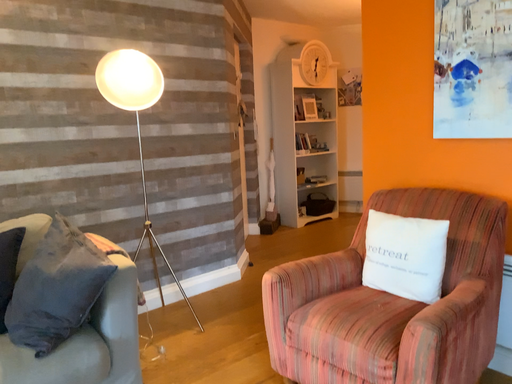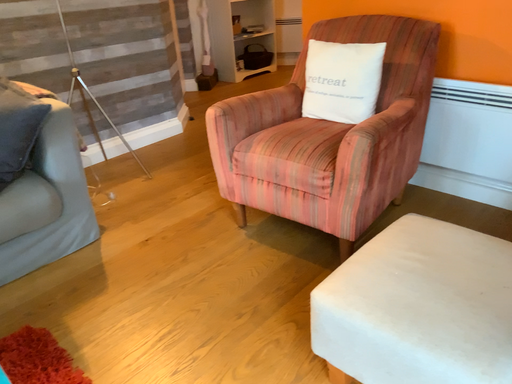
Question: Which way did the camera rotate in the video?

Choices:
 (A) rotated upward
 (B) rotated downward

Answer: (B)